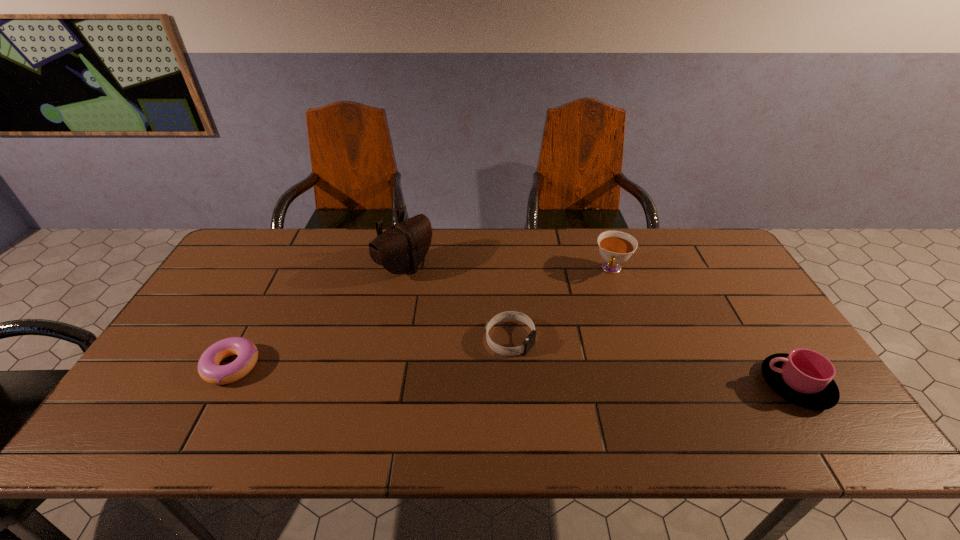
At what (x,y) coordinates should I click in order to perform the action: click on vacant space at the near edge. Please return your answer as a coordinate pair (x, y). Looking at the image, I should click on (271, 382).

Where is `vacant region at the near left corner of the desktop`? vacant region at the near left corner of the desktop is located at coordinates (139, 386).

Locate an element on the screen. This screenshot has width=960, height=540. blank space at the far right corner of the desktop is located at coordinates (698, 247).

Image resolution: width=960 pixels, height=540 pixels. In order to click on blank region between the third tallest object and the leftmost object in this screenshot , I will do `click(514, 376)`.

Where is `vacant space that's between the pouch and the wristband`? This screenshot has width=960, height=540. vacant space that's between the pouch and the wristband is located at coordinates (458, 303).

At what (x,y) coordinates should I click in order to perform the action: click on free space that is in between the third object from right to left and the pouch. Please return your answer as a coordinate pair (x, y). This screenshot has height=540, width=960. Looking at the image, I should click on (458, 303).

Identify the location of empty location between the leftmost object and the second object from left to right. (319, 316).

Find the location of a particular element. The image size is (960, 540). free spot between the doughnut and the cup is located at coordinates (514, 376).

At what (x,y) coordinates should I click in order to perform the action: click on vacant space in between the fourth object from left to right and the cup. Please return your answer as a coordinate pair (x, y). Looking at the image, I should click on (704, 327).

Where is `empty space between the teacup and the third tallest object`? empty space between the teacup and the third tallest object is located at coordinates (704, 327).